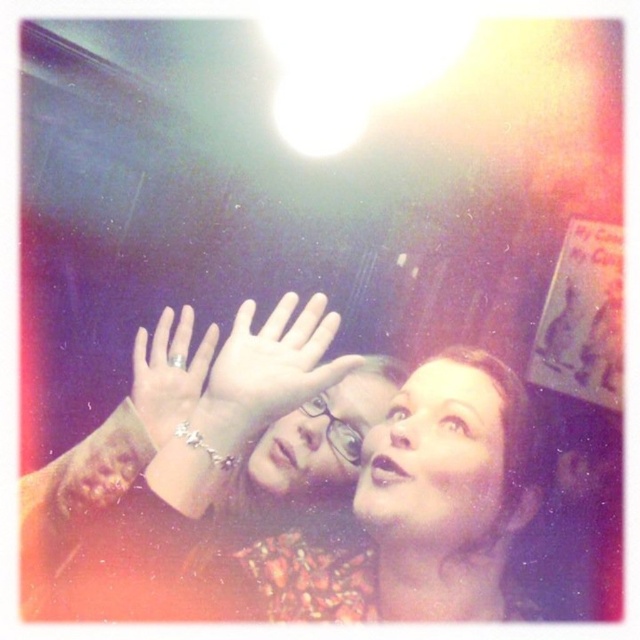
Question: Which of the following is the farthest from the observer?

Choices:
 (A) matte glass face at upper center
 (B) matte skin hand at center

Answer: (A)

Question: Among these objects, which one is farthest from the camera?

Choices:
 (A) silver metallic ring at upper center
 (B) matte brown hair at center
 (C) matte skin hand at center

Answer: (B)

Question: Does matte brown hair at center have a greater width compared to matte skin hand at center?

Choices:
 (A) yes
 (B) no

Answer: (A)

Question: Can you confirm if matte skin hand at center is bigger than silver metallic ring at upper center?

Choices:
 (A) no
 (B) yes

Answer: (A)

Question: Which point is closer to the camera taking this photo?

Choices:
 (A) (138, 381)
 (B) (296, 492)

Answer: (A)

Question: Does matte glass face at upper center come in front of silver metallic ring at upper center?

Choices:
 (A) no
 (B) yes

Answer: (A)